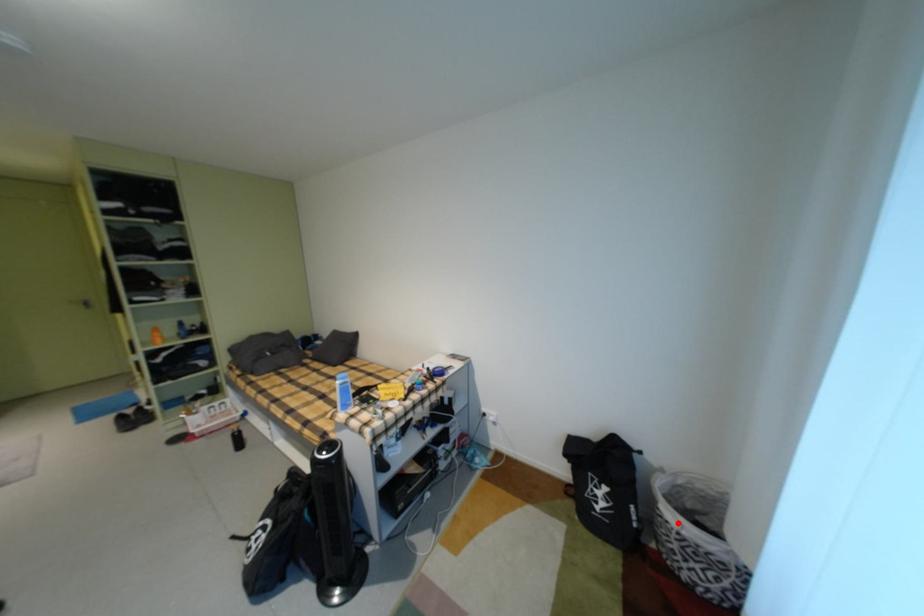
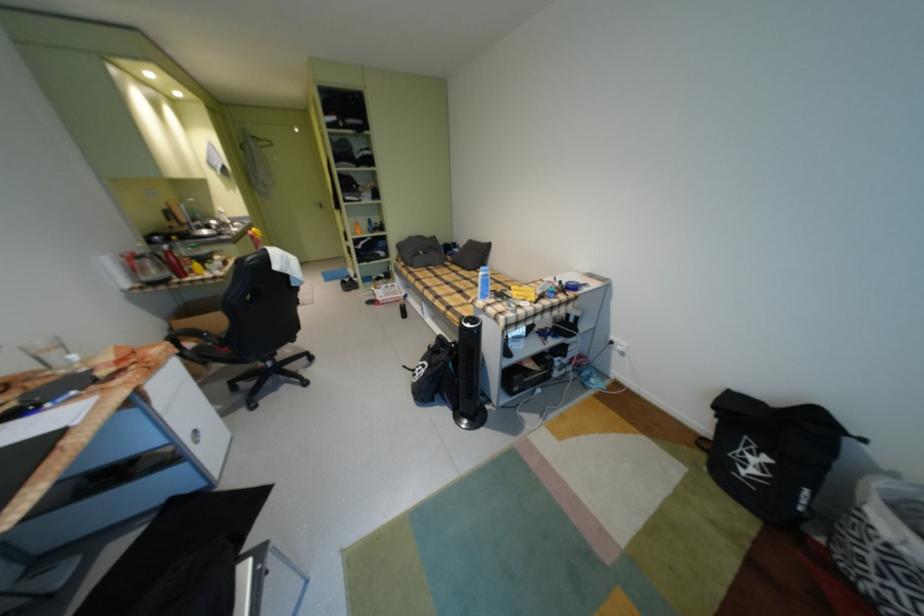
Question: I am providing you with two images of the same scene from different viewpoints. A red point is shown in image1. For the corresponding object point in image2, is it positioned nearer or farther from the camera?

Choices:
 (A) Nearer
 (B) Farther

Answer: (B)